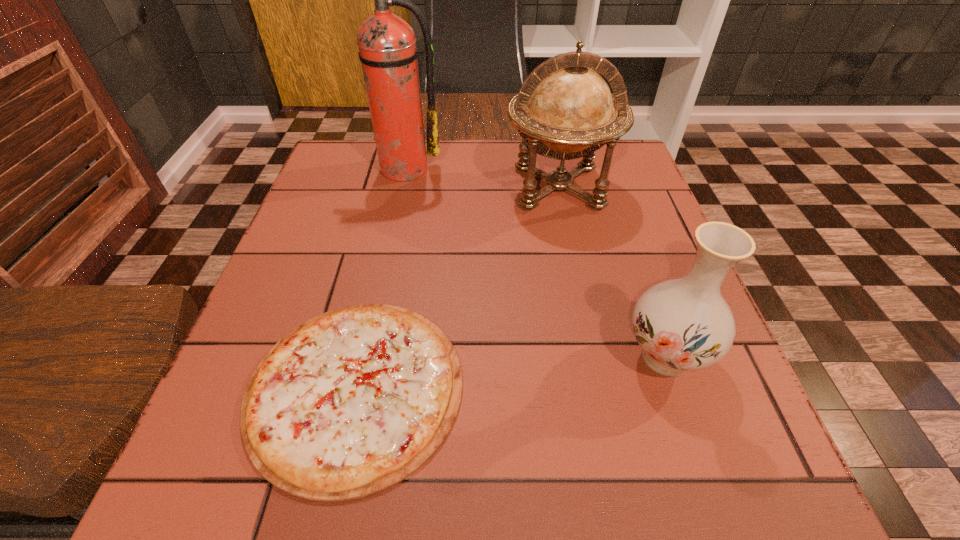
Where is `vacant point located between the third tallest object and the globe`? vacant point located between the third tallest object and the globe is located at coordinates (612, 272).

Where is `empty location between the pizza and the fire extinguisher`? This screenshot has width=960, height=540. empty location between the pizza and the fire extinguisher is located at coordinates (378, 278).

Identify the location of free spot between the globe and the fire extinguisher. (480, 178).

Identify the location of free space between the third tallest object and the tallest object. The width and height of the screenshot is (960, 540). (534, 262).

Select which object is the third closest to the tallest object. Please provide its 2D coordinates. Your answer should be formatted as a tuple, i.e. [(x, y)], where the tuple contains the x and y coordinates of a point satisfying the conditions above.

[(684, 324)]

Where is `object that is the closest to the shortest object`? The height and width of the screenshot is (540, 960). object that is the closest to the shortest object is located at coordinates (564, 110).

At what (x,y) coordinates should I click in order to perform the action: click on blank space that satisfies the following two spatial constraints: 1. on the front-facing side of the second shortest object; 2. on the right side of the third shortest object. Please return your answer as a coordinate pair (x, y). Looking at the image, I should click on (595, 356).

The height and width of the screenshot is (540, 960). In order to click on vacant region that satisfies the following two spatial constraints: 1. on the front-facing side of the globe; 2. on the right side of the vase in this screenshot , I will do `click(595, 356)`.